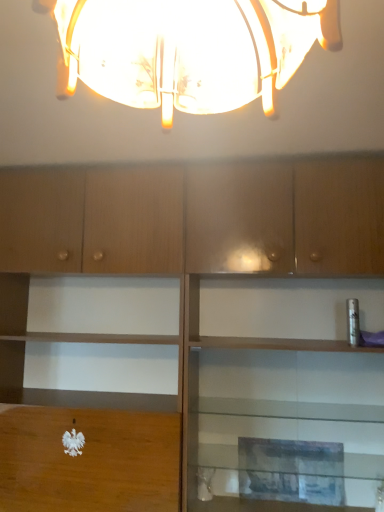
At what (x,y) coordinates should I click in order to perform the action: click on wooden cabinet at center. Please return your answer as a coordinate pair (x, y). Image resolution: width=384 pixels, height=512 pixels. Looking at the image, I should click on tap(197, 225).

What do you see at coordinates (197, 225) in the screenshot? The image size is (384, 512). I see `wooden cabinet at center` at bounding box center [197, 225].

What is the approximate width of wooden cabinet at center?

The width of wooden cabinet at center is 23.21 inches.

What do you see at coordinates (190, 50) in the screenshot?
I see `translucent glass lampshade at upper center` at bounding box center [190, 50].

Locate an element on the screen. This screenshot has width=384, height=512. translucent glass lampshade at upper center is located at coordinates (190, 50).

Locate an element on the screen. This screenshot has height=512, width=384. wooden cabinet at center is located at coordinates (197, 225).

In the scene shown: Which object is positioned more to the right, wooden cabinet at center or translucent glass lampshade at upper center?

From the viewer's perspective, wooden cabinet at center appears more on the right side.

Considering their positions, is wooden cabinet at center located in front of or behind translucent glass lampshade at upper center?

wooden cabinet at center is behind translucent glass lampshade at upper center.

Does point (208, 193) come closer to viewer compared to point (297, 60)?

No.

From the image's perspective, is wooden cabinet at center above or below translucent glass lampshade at upper center?

wooden cabinet at center is below translucent glass lampshade at upper center.

From a real-world perspective, between wooden cabinet at center and translucent glass lampshade at upper center, who is vertically lower?

wooden cabinet at center, from a real-world perspective.

In terms of width, does wooden cabinet at center look wider or thinner when compared to translucent glass lampshade at upper center?

wooden cabinet at center is wider than translucent glass lampshade at upper center.

Considering the sizes of objects wooden cabinet at center and translucent glass lampshade at upper center in the image provided, who is shorter, wooden cabinet at center or translucent glass lampshade at upper center?

Standing shorter between the two is translucent glass lampshade at upper center.

Based on their sizes in the image, would you say wooden cabinet at center is bigger or smaller than translucent glass lampshade at upper center?

In the image, wooden cabinet at center appears to be larger than translucent glass lampshade at upper center.

Would you say wooden cabinet at center is outside translucent glass lampshade at upper center?

Yes, wooden cabinet at center is located beyond the bounds of translucent glass lampshade at upper center.

Is wooden cabinet at center not near translucent glass lampshade at upper center?

Absolutely, wooden cabinet at center is distant from translucent glass lampshade at upper center.

In the scene shown: Could you tell me if wooden cabinet at center is turned towards translucent glass lampshade at upper center?

Yes, wooden cabinet at center is facing translucent glass lampshade at upper center.

The width and height of the screenshot is (384, 512). In the image, there is a translucent glass lampshade at upper center. Find the location of `cabinetry below it (from the image's perspective)`. cabinetry below it (from the image's perspective) is located at coordinates (197, 225).

Considering the positions of objects translucent glass lampshade at upper center and wooden cabinet at center in the image provided, who is more to the right, translucent glass lampshade at upper center or wooden cabinet at center?

wooden cabinet at center.

Is translucent glass lampshade at upper center behind wooden cabinet at center?

No, translucent glass lampshade at upper center is closer to the viewer.

Which point is more forward, [73,70] or [121,197]?

The point [73,70] is more forward.

From the image's perspective, between translucent glass lampshade at upper center and wooden cabinet at center, which one is located above?

translucent glass lampshade at upper center, from the image's perspective.

From a real-world perspective, is translucent glass lampshade at upper center positioned above or below wooden cabinet at center?

In terms of real-world spatial position, translucent glass lampshade at upper center is above wooden cabinet at center.

Considering the sizes of translucent glass lampshade at upper center and wooden cabinet at center in the image, is translucent glass lampshade at upper center wider or thinner than wooden cabinet at center?

Clearly, translucent glass lampshade at upper center has less width compared to wooden cabinet at center.

Between translucent glass lampshade at upper center and wooden cabinet at center, which one has more height?

wooden cabinet at center is taller.

Which of these two, translucent glass lampshade at upper center or wooden cabinet at center, is bigger?

wooden cabinet at center.

Is translucent glass lampshade at upper center situated inside wooden cabinet at center or outside?

translucent glass lampshade at upper center is spatially situated outside wooden cabinet at center.

Is the surface of translucent glass lampshade at upper center in direct contact with wooden cabinet at center?

No, translucent glass lampshade at upper center is not beside wooden cabinet at center.

Does translucent glass lampshade at upper center turn towards wooden cabinet at center?

No, translucent glass lampshade at upper center is not facing towards wooden cabinet at center.

You are a GUI agent. You are given a task and a screenshot of the screen. Output one action in this format:
    pyautogui.click(x=<x>, y=<y>)
    Task: Click on the lamp above the wooden cabinet at center (from the image's perspective)
    
    Given the screenshot: What is the action you would take?
    pyautogui.click(x=190, y=50)

At what (x,y) coordinates should I click in order to perform the action: click on cabinetry on the right side of translucent glass lampshade at upper center. Please return your answer as a coordinate pair (x, y). The image size is (384, 512). Looking at the image, I should click on (197, 225).

This screenshot has width=384, height=512. What are the coordinates of `lamp on the left of the wooden cabinet at center` in the screenshot? It's located at (190, 50).